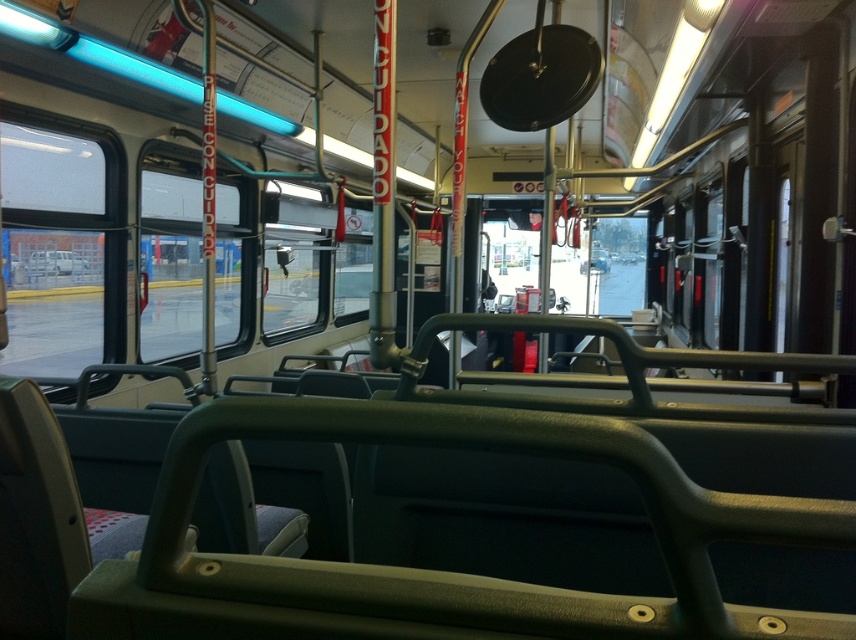
You are a passenger on a moving bus and need to reach a specific point marked at coordinates point (21, 125). Your backpack is 0.5 meters in width. Can you safely walk to that point without bumping into the handrails or other passengers?

The point (21, 125) is 3.11 meters away from you. Since your backpack is only 0.5 meters wide, you have enough space to walk to the point without bumping into handrails or others, provided the path is clear.

You are a passenger on a moving bus and want to check the outside weather through the windows. Which window, the transparent glass window at left or the transparent glass window at center, allows you to see a wider view of the street?

The transparent glass window at left allows you to see a wider view of the street because it has a larger size compared to the transparent glass window at center.

You are a passenger on a moving bus and want to look outside through the transparent glass window at left and the transparent glass window at center. Which window should you look through if you want to see the left side of the bus?

You should look through the transparent glass window at left because it is positioned to the left of the transparent glass window at center, making it the better option to view the left side of the bus.